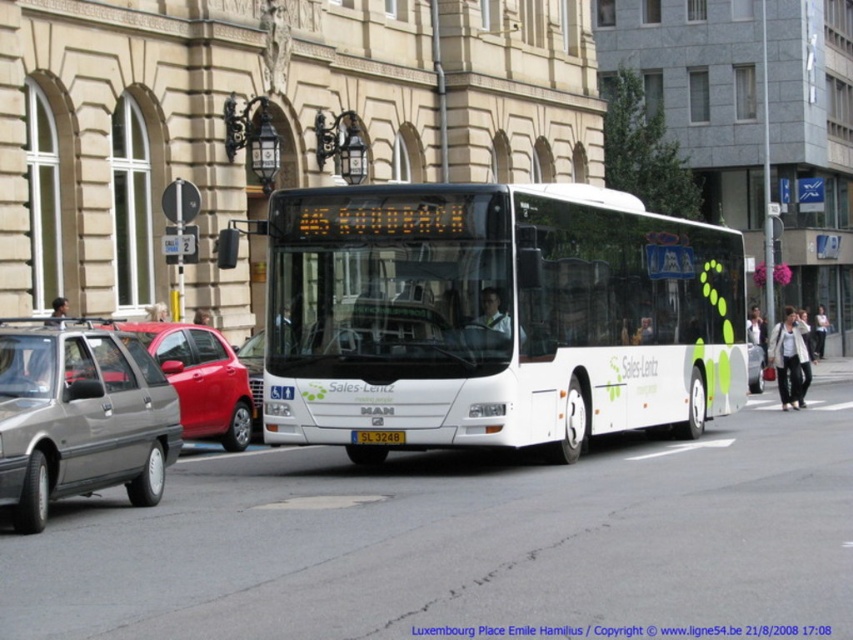
You are a parking attendant trying to fit a car into a parking spot that can only accommodate vehicles narrower than the yellow matte license plate at center. Can the metallic gray sedan at left fit into this spot?

The metallic gray sedan at left is wider than the yellow matte license plate at center, so it cannot fit into the parking spot designed for narrower vehicles.

In the scene shown: You are standing at the point with coordinates point (735, 250) and want to walk to the point point (403, 435). Which direction should you move to reach your destination?

You should move forward because point (735, 250) is behind point (403, 435), so moving forward from point (735, 250) will lead you to point (403, 435).

You are a traffic officer observing the scene. There is a metallic gray sedan at left and a yellow matte license plate at center. Which vehicle is positioned to the left of the other?

The metallic gray sedan at left is to the left of the yellow matte license plate at center.